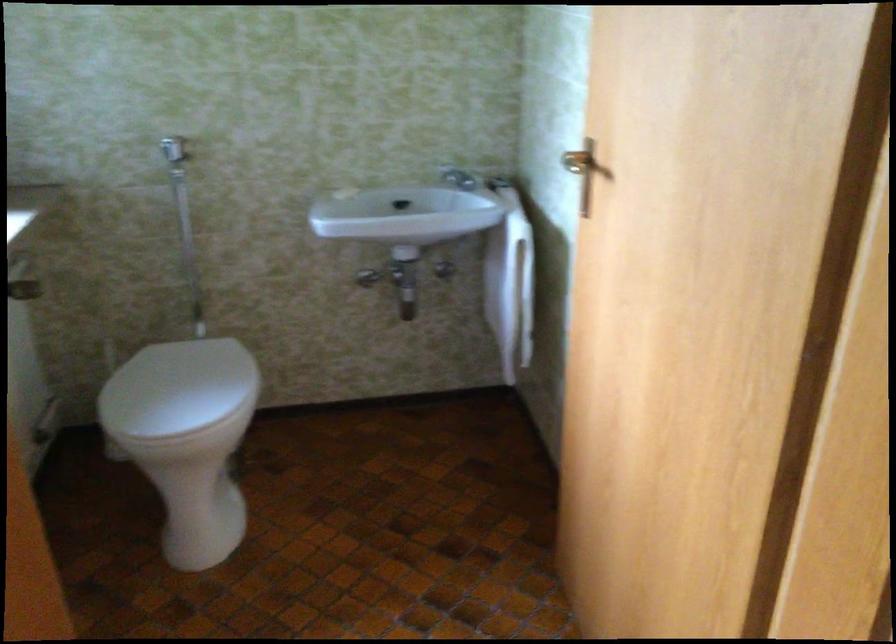
Where would you turn the silver faucet handle? Please return your answer as a coordinate pair (x, y).

(458, 178)